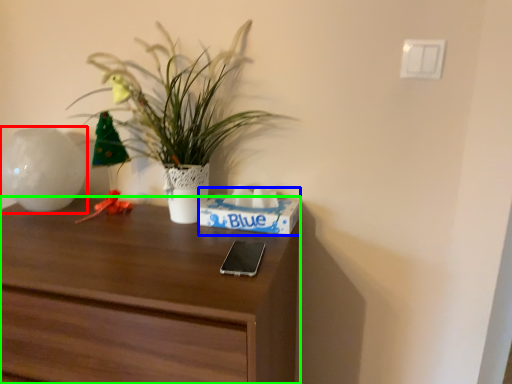
Question: Which object is the farthest from vase (highlighted by a red box)? Choose among these: shoe box (highlighted by a blue box) or desk (highlighted by a green box).

Choices:
 (A) shoe box
 (B) desk

Answer: (A)